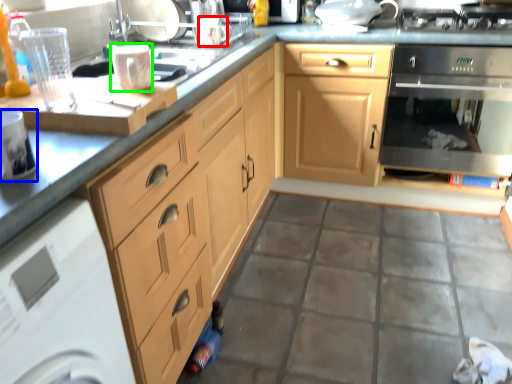
Question: Which object is the closest to the appliance (highlighted by a red box)? Choose among these: kitchen appliance (highlighted by a blue box) or appliance (highlighted by a green box).

Choices:
 (A) kitchen appliance
 (B) appliance

Answer: (B)